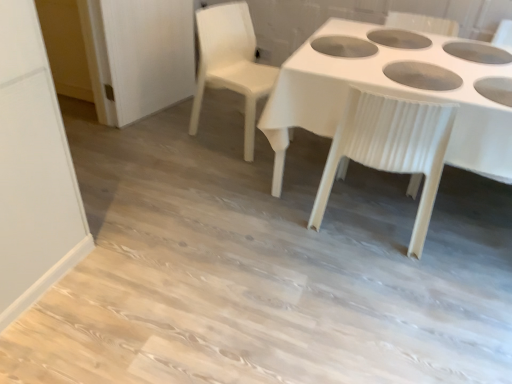
The image size is (512, 384). In order to click on free location to the right of white plastic chair at center, the second chair positioned from the left in this screenshot , I will do `click(466, 230)`.